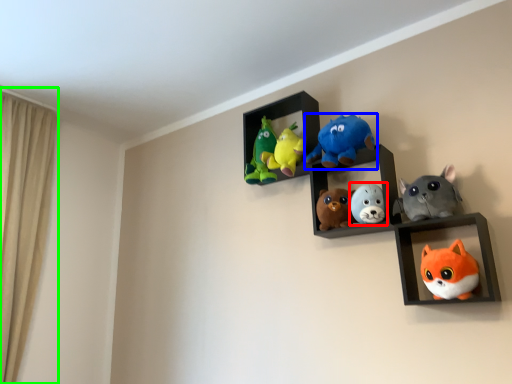
Question: Which is nearer to the toy (highlighted by a red box)? toy (highlighted by a blue box) or curtain (highlighted by a green box).

Choices:
 (A) toy
 (B) curtain

Answer: (A)